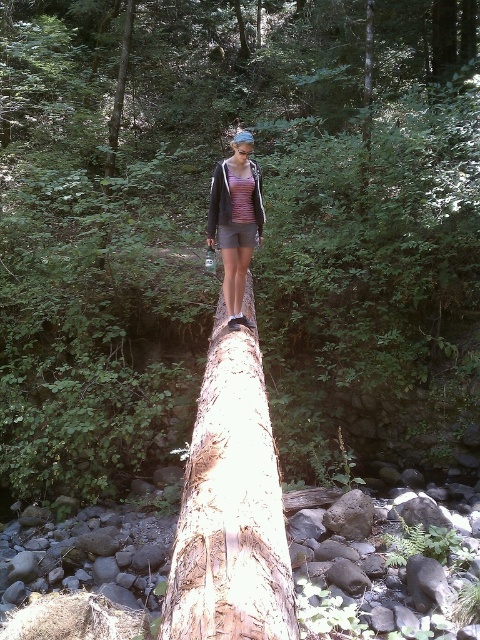
You are a hiker who wants to take a photo of the light brown rough tree trunk at center and the matte purple tank top at center. From your current position, which object will appear closer in the photo?

The light brown rough tree trunk at center will appear closer in the photo because it is in front of the matte purple tank top at center.

You are a photographer trying to capture the person on the light brown rough tree trunk at center and their matte purple tank top at center. Which object should you focus on first if you want to ensure both are in sharp focus?

You should focus on the light brown rough tree trunk at center first because it is positioned under the matte purple tank top at center, meaning it is farther away from the camera. By focusing on the farther object, you can ensure both are in sharp focus.

You are a hiker trying to cross the light brown rough tree trunk at center. You notice the matte purple tank top at center nearby. Which object is bigger in size?

The light brown rough tree trunk at center is larger in size compared to the matte purple tank top at center.